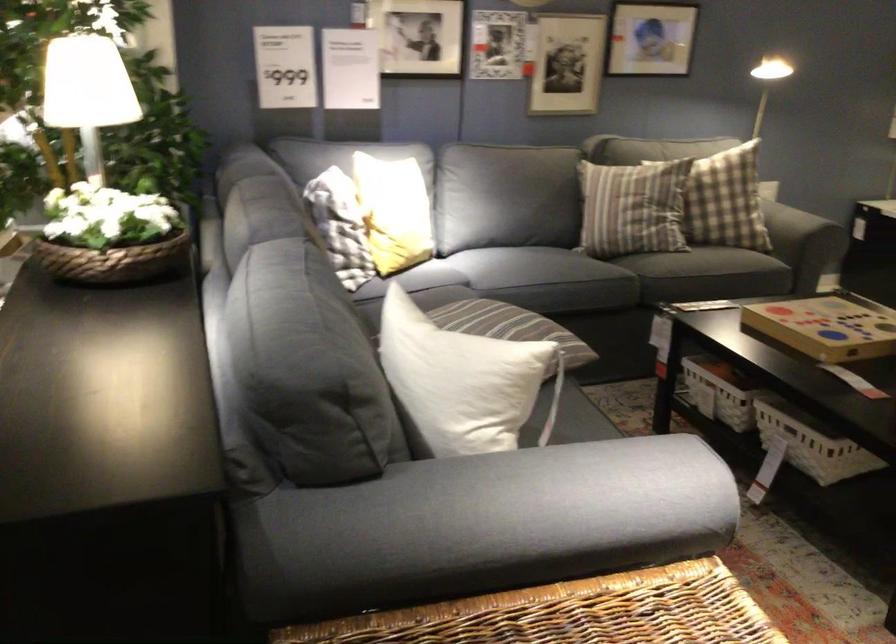
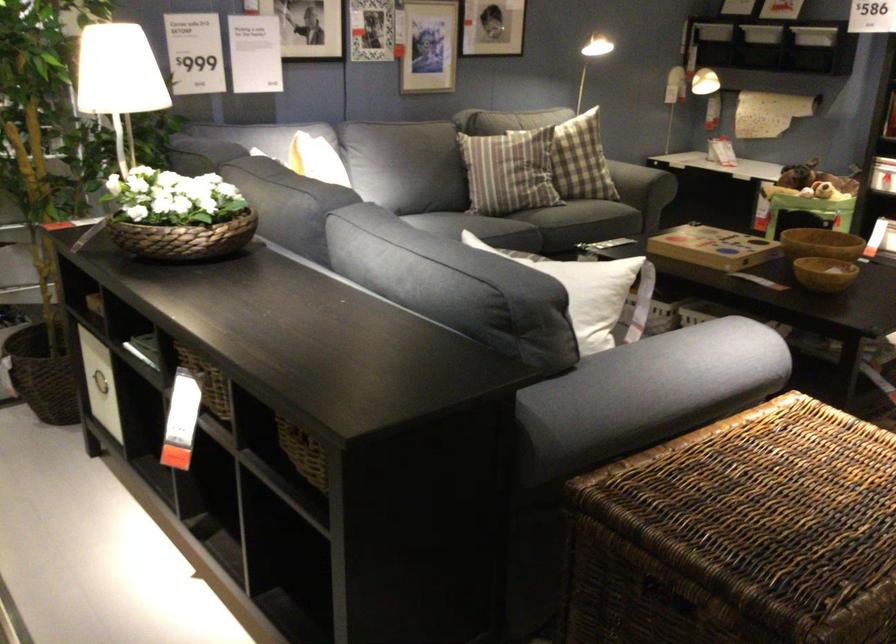
Where in the second image is the point corresponding to (x=709, y=183) from the first image?

(581, 160)